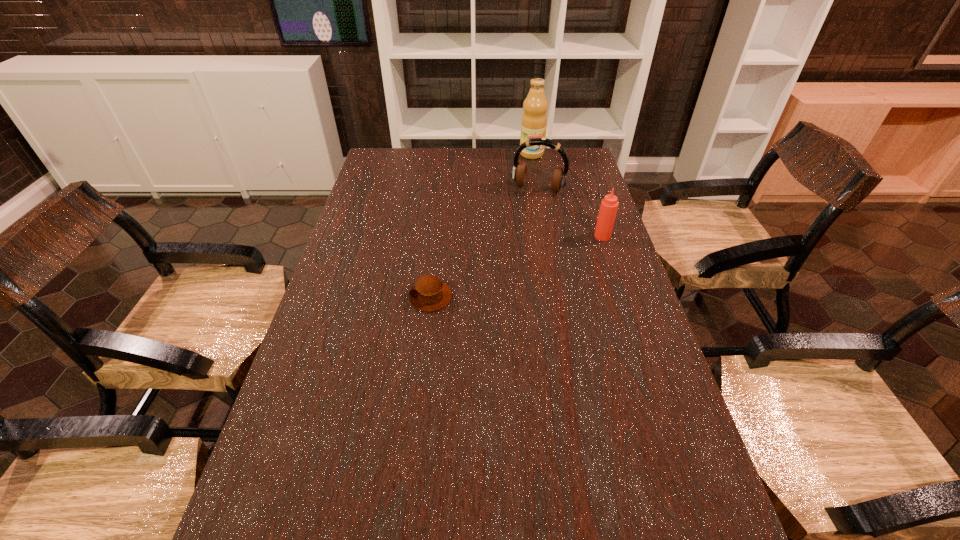
This screenshot has height=540, width=960. Identify the location of vacant space located 0.300m on the ear cup of the headset. (512, 245).

Where is `vacant point located 0.170m on the ear cup of the headset`? The width and height of the screenshot is (960, 540). vacant point located 0.170m on the ear cup of the headset is located at coordinates (520, 222).

Where is `vacant area situated on the label of the tallest object`? vacant area situated on the label of the tallest object is located at coordinates (537, 200).

Locate an element on the screen. Image resolution: width=960 pixels, height=540 pixels. free space located on the label of the tallest object is located at coordinates [x=539, y=215].

In order to click on vacant space located 0.220m on the label of the tallest object in this screenshot , I will do `click(536, 188)`.

Find the location of `object that is at the far edge`. object that is at the far edge is located at coordinates (534, 120).

Locate an element on the screen. This screenshot has width=960, height=540. Tabasco sauce present at the right edge is located at coordinates (609, 205).

Identify the location of headset at the right edge. This screenshot has height=540, width=960. (519, 171).

Locate an element on the screen. This screenshot has width=960, height=540. free space at the far edge of the desktop is located at coordinates (437, 169).

Where is `vacant region at the left edge of the desktop`? vacant region at the left edge of the desktop is located at coordinates (367, 309).